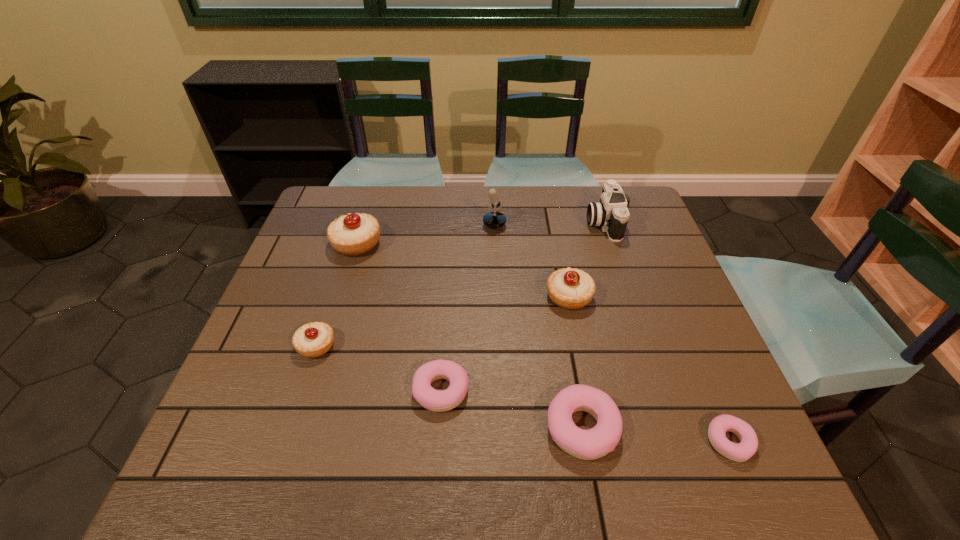
This screenshot has height=540, width=960. Find the location of `pastry that is the sixth closest to the white microphone`. pastry that is the sixth closest to the white microphone is located at coordinates (748, 445).

Point out which pastry is positioned as the fifth nearest to the third farthest pastry. Please provide its 2D coordinates. Your answer should be formatted as a tuple, i.e. [(x, y)], where the tuple contains the x and y coordinates of a point satisfying the conditions above.

[(748, 445)]

Where is `beige pastry object that ranks as the third closest to the seventh object from left to right`? This screenshot has height=540, width=960. beige pastry object that ranks as the third closest to the seventh object from left to right is located at coordinates (312, 340).

Identify which beige pastry is the second closest to the third shortest pastry. Please provide its 2D coordinates. Your answer should be formatted as a tuple, i.e. [(x, y)], where the tuple contains the x and y coordinates of a point satisfying the conditions above.

[(312, 340)]

At what (x,y) coordinates should I click in order to perform the action: click on pink pastry identified as the second closest to the smallest beige pastry. Please return your answer as a coordinate pair (x, y). The width and height of the screenshot is (960, 540). Looking at the image, I should click on (590, 444).

Select which pink pastry appears as the closest to the fifth tallest pastry. Please provide its 2D coordinates. Your answer should be formatted as a tuple, i.e. [(x, y)], where the tuple contains the x and y coordinates of a point satisfying the conditions above.

[(590, 444)]